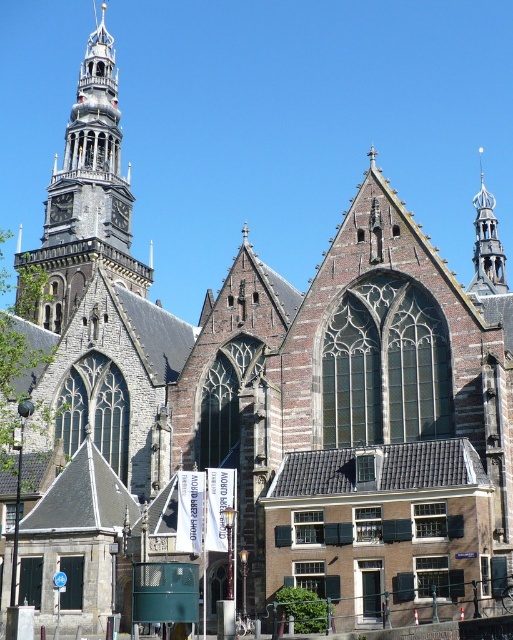
Question: Which object appears farthest from the camera in this image?

Choices:
 (A) brown stone tower at upper left
 (B) polished brass spire at upper right

Answer: (A)

Question: Considering the relative positions of brown stone tower at upper left and polished brass spire at upper right in the image provided, where is brown stone tower at upper left located with respect to polished brass spire at upper right?

Choices:
 (A) right
 (B) left

Answer: (B)

Question: Does brown stone tower at upper left have a smaller size compared to polished brass spire at upper right?

Choices:
 (A) no
 (B) yes

Answer: (A)

Question: Which of the following is the closest to the observer?

Choices:
 (A) brown stone tower at upper left
 (B) polished brass spire at upper right

Answer: (B)

Question: Is the position of brown stone tower at upper left more distant than that of polished brass spire at upper right?

Choices:
 (A) yes
 (B) no

Answer: (A)